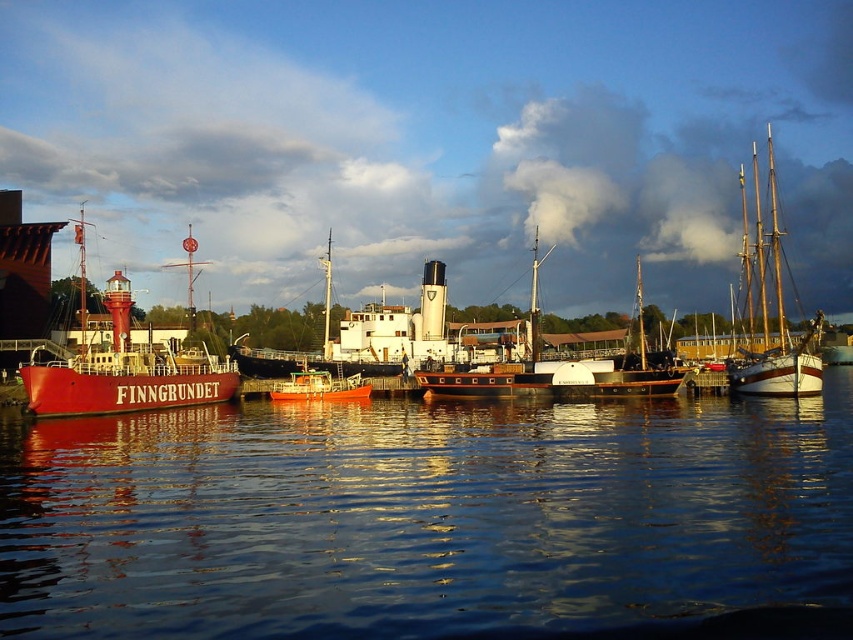
You are a photographer planning to take a picture of the matte red ship at left and the wooden ship at center from the dock. Which ship should you position yourself closer to if you want both ships to be equally visible in your photo?

You should position yourself closer to the matte red ship at left since it is on the left side of the wooden ship at center, allowing both ships to be captured equally in the photo.

You are standing at the edge of the harbor looking out at the boats. There are two points marked on the water surface. The first point is at coordinates point (126, 374) and the second point is at point (672, 380). Which point is closer to you?

Point (126, 374) is closer to the camera than point (672, 380), so the first point is closer to you.